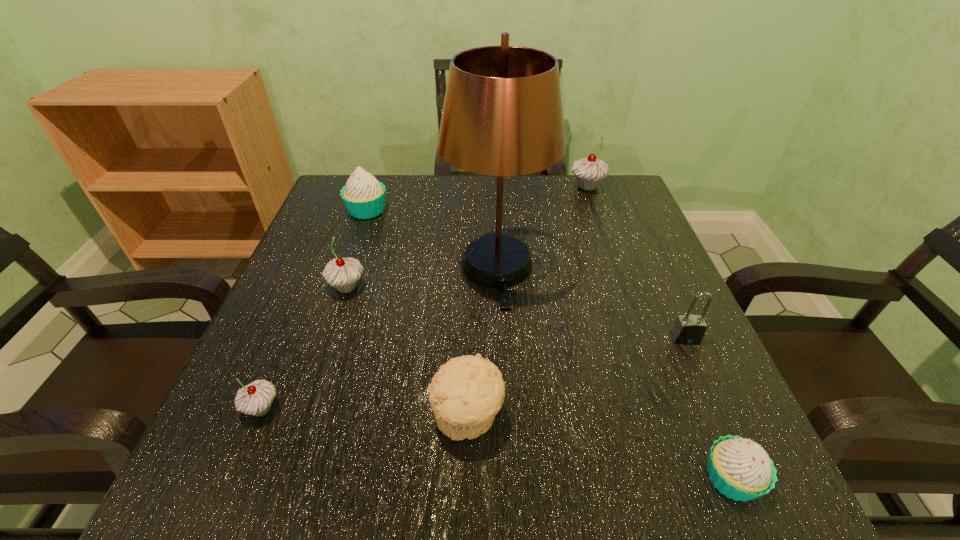
Locate an element on the screen. vacant region located 0.290m on the back of the nearest gray cupcake is located at coordinates (317, 274).

Find the location of `blank space located on the left of the nearest cupcake`. blank space located on the left of the nearest cupcake is located at coordinates (559, 478).

The width and height of the screenshot is (960, 540). In order to click on muffin located in the near edge section of the desktop in this screenshot , I will do click(x=467, y=392).

You are a GUI agent. You are given a task and a screenshot of the screen. Output one action in this format:
    pyautogui.click(x=<x>, y=<y>)
    Task: Click on the cupcake present at the near edge
    This screenshot has width=960, height=540.
    Given the screenshot: What is the action you would take?
    pyautogui.click(x=741, y=469)

Image resolution: width=960 pixels, height=540 pixels. In order to click on padlock located in the right edge section of the desktop in this screenshot , I will do `click(687, 329)`.

You are a GUI agent. You are given a task and a screenshot of the screen. Output one action in this format:
    pyautogui.click(x=<x>, y=<y>)
    Task: Click on the object present at the far left corner
    
    Given the screenshot: What is the action you would take?
    pyautogui.click(x=364, y=197)

Image resolution: width=960 pixels, height=540 pixels. In order to click on object positioned at the far right corner in this screenshot , I will do `click(589, 171)`.

The height and width of the screenshot is (540, 960). In order to click on object positioned at the near right corner in this screenshot , I will do `click(741, 469)`.

In the image, there is a desktop. At what (x,y) coordinates should I click in order to perform the action: click on free region at the far edge. Please return your answer as a coordinate pair (x, y). The height and width of the screenshot is (540, 960). Looking at the image, I should click on (456, 187).

At what (x,y) coordinates should I click in order to perform the action: click on free location at the near edge. Please return your answer as a coordinate pair (x, y). Looking at the image, I should click on (447, 497).